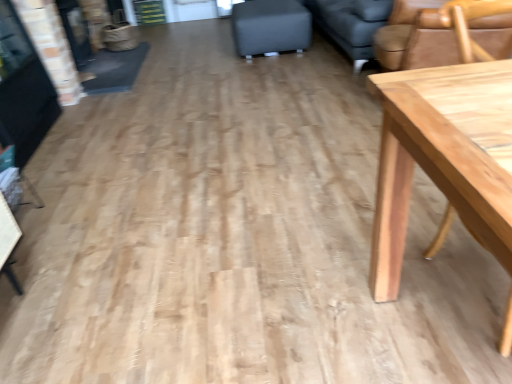
Question: Considering the relative sizes of matte black ottoman at center and light brown wood chair at upper right in the image provided, is matte black ottoman at center thinner than light brown wood chair at upper right?

Choices:
 (A) yes
 (B) no

Answer: (A)

Question: Considering the relative sizes of matte black ottoman at center and light brown wood chair at upper right in the image provided, is matte black ottoman at center wider than light brown wood chair at upper right?

Choices:
 (A) yes
 (B) no

Answer: (B)

Question: Does matte black ottoman at center have a larger size compared to light brown wood chair at upper right?

Choices:
 (A) yes
 (B) no

Answer: (B)

Question: From a real-world perspective, is matte black ottoman at center located beneath light brown wood chair at upper right?

Choices:
 (A) yes
 (B) no

Answer: (A)

Question: Is matte black ottoman at center oriented towards light brown wood chair at upper right?

Choices:
 (A) yes
 (B) no

Answer: (B)

Question: Does matte black ottoman at center come in front of light brown wood chair at upper right?

Choices:
 (A) yes
 (B) no

Answer: (B)

Question: Is light brown wood chair at upper right taller than matte black ottoman at center?

Choices:
 (A) yes
 (B) no

Answer: (A)

Question: Does light brown wood chair at upper right have a larger size compared to matte black ottoman at center?

Choices:
 (A) no
 (B) yes

Answer: (B)

Question: Considering the relative sizes of light brown wood chair at upper right and matte black ottoman at center in the image provided, is light brown wood chair at upper right smaller than matte black ottoman at center?

Choices:
 (A) yes
 (B) no

Answer: (B)

Question: Would you say light brown wood chair at upper right is a long distance from matte black ottoman at center?

Choices:
 (A) yes
 (B) no

Answer: (A)

Question: From a real-world perspective, is light brown wood chair at upper right located beneath matte black ottoman at center?

Choices:
 (A) no
 (B) yes

Answer: (A)

Question: Considering the relative positions of light brown wood chair at upper right and matte black ottoman at center in the image provided, is light brown wood chair at upper right to the right of matte black ottoman at center from the viewer's perspective?

Choices:
 (A) yes
 (B) no

Answer: (A)

Question: From the image's perspective, is light brown wood chair at upper right above or below matte black ottoman at center?

Choices:
 (A) below
 (B) above

Answer: (A)